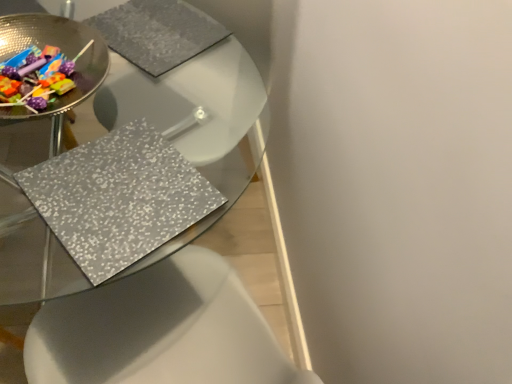
Question: Looking at their shapes, would you say shiny metallic bowl at upper left is wider or thinner than metallic silver placemat at center?

Choices:
 (A) thin
 (B) wide

Answer: (A)

Question: In the image, is shiny metallic bowl at upper left on the left side or the right side of metallic silver placemat at center?

Choices:
 (A) right
 (B) left

Answer: (A)

Question: In the image, is shiny metallic bowl at upper left positioned in front of or behind metallic silver placemat at center?

Choices:
 (A) front
 (B) behind

Answer: (B)

Question: Looking at the image, does metallic silver placemat at center seem bigger or smaller compared to shiny metallic bowl at upper left?

Choices:
 (A) big
 (B) small

Answer: (A)

Question: Considering the relative positions of metallic silver placemat at center and shiny metallic bowl at upper left in the image provided, is metallic silver placemat at center to the left or to the right of shiny metallic bowl at upper left?

Choices:
 (A) right
 (B) left

Answer: (B)

Question: Which is correct: metallic silver placemat at center is inside shiny metallic bowl at upper left, or outside of it?

Choices:
 (A) outside
 (B) inside

Answer: (A)

Question: In terms of height, does metallic silver placemat at center look taller or shorter compared to shiny metallic bowl at upper left?

Choices:
 (A) tall
 (B) short

Answer: (A)